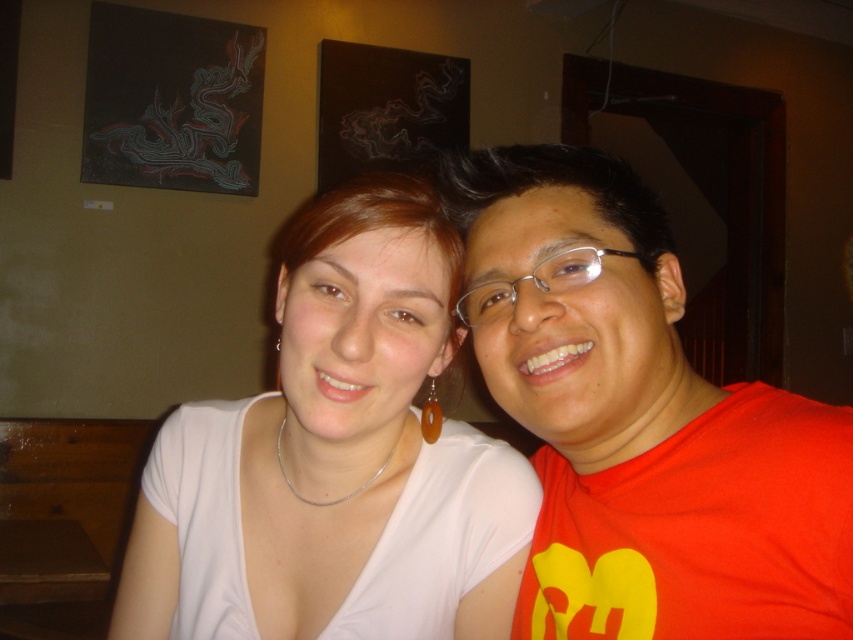
Can you confirm if white matte shirt at center is wider than clear plastic glasses at center?

Indeed, white matte shirt at center has a greater width compared to clear plastic glasses at center.

Who is taller, white matte shirt at center or clear plastic glasses at center?

white matte shirt at center

Where is `white matte shirt at center`? white matte shirt at center is located at coordinates (335, 458).

What do you see at coordinates (640, 420) in the screenshot? The height and width of the screenshot is (640, 853). I see `matte red t-shirt at right` at bounding box center [640, 420].

Which is in front, point (683, 454) or point (549, 282)?

Point (549, 282) is in front.

Where is `matte red t-shirt at right`? This screenshot has height=640, width=853. matte red t-shirt at right is located at coordinates (640, 420).

Does point (572, 547) come behind point (223, 557)?

Yes.

Is point (776, 499) closer to viewer compared to point (141, 534)?

Yes, it is in front of point (141, 534).

What are the coordinates of `matte red t-shirt at right` in the screenshot? It's located at (640, 420).